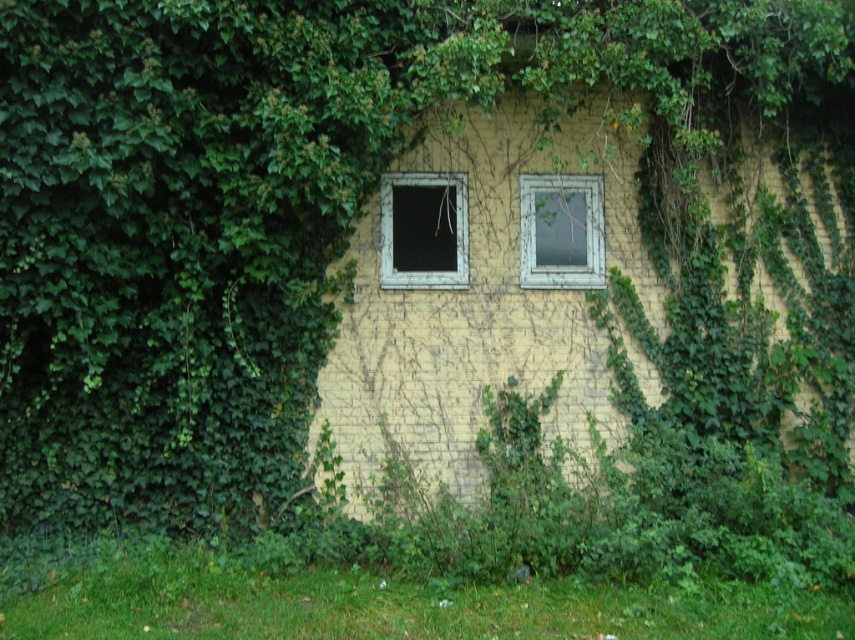
Consider the image. Is matte gray window at center shorter than white wooden window at center?

Correct, matte gray window at center is not as tall as white wooden window at center.

Which is below, matte gray window at center or white wooden window at center?

matte gray window at center is lower down.

Who is more distant from viewer, (426, 266) or (541, 189)?

The point (541, 189) is more distant.

The height and width of the screenshot is (640, 855). Find the location of `matte gray window at center`. matte gray window at center is located at coordinates (423, 230).